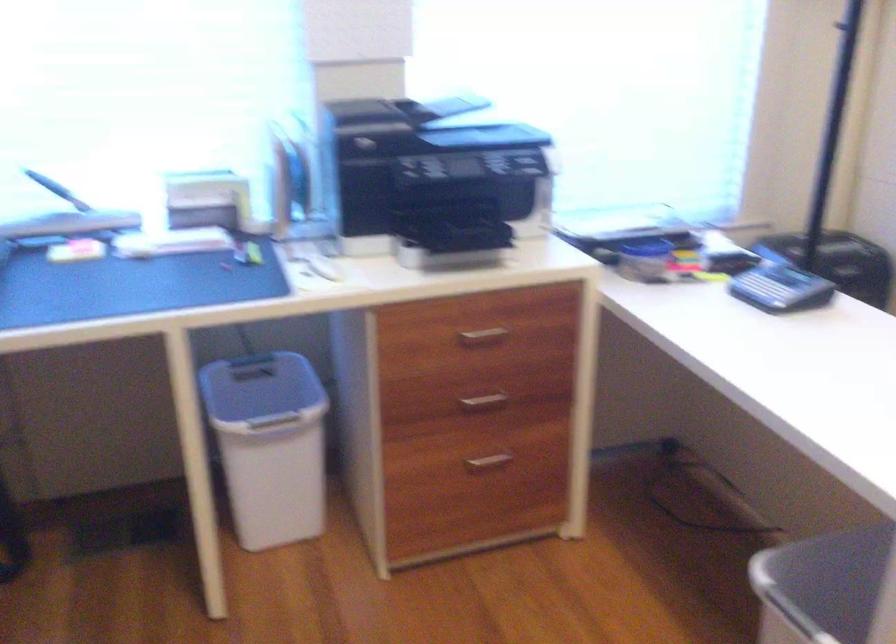
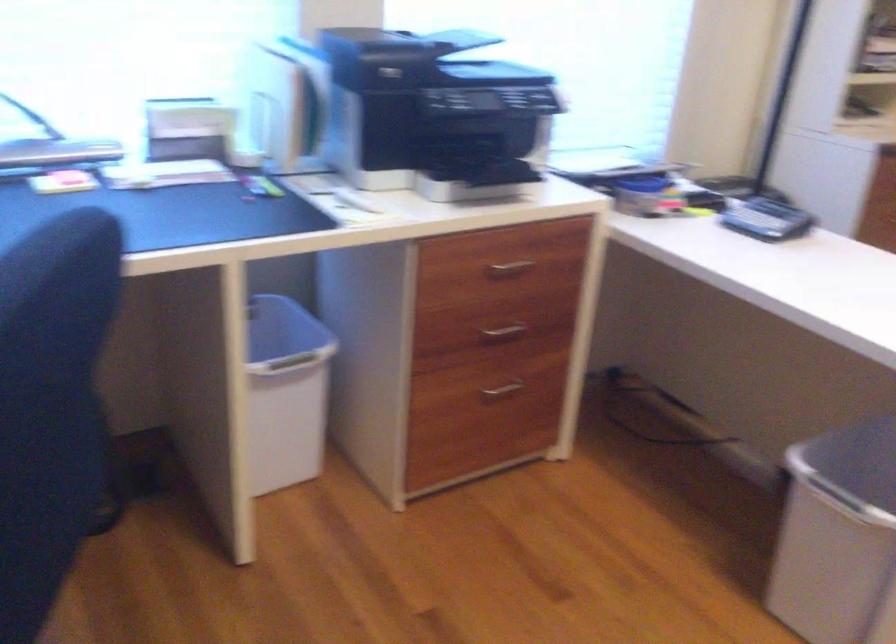
In the second image, find the point that corresponds to the point at 487,337 in the first image.

(510, 268)